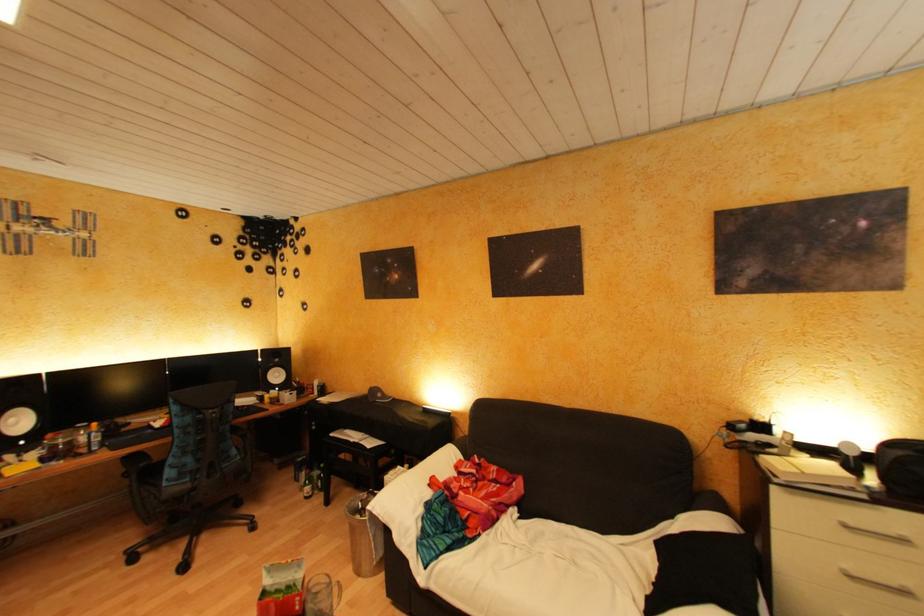
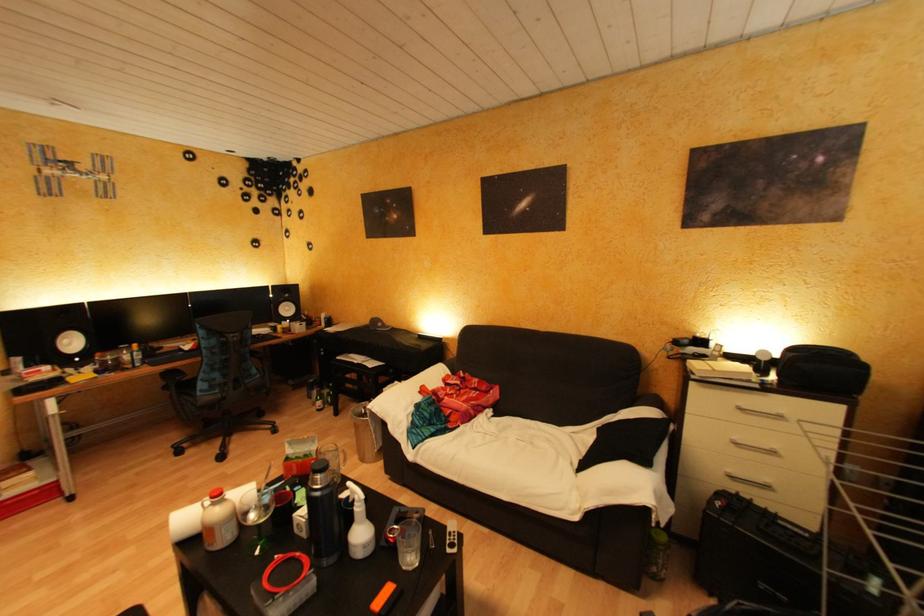
The images are taken continuously from a first-person perspective. In which direction are you moving?

The movement direction of the cameraman is right, backward.